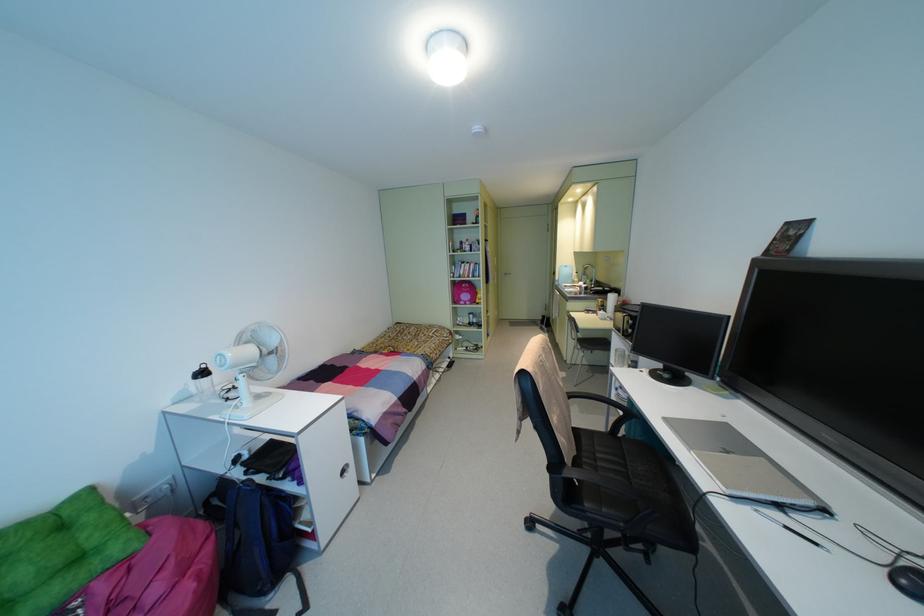
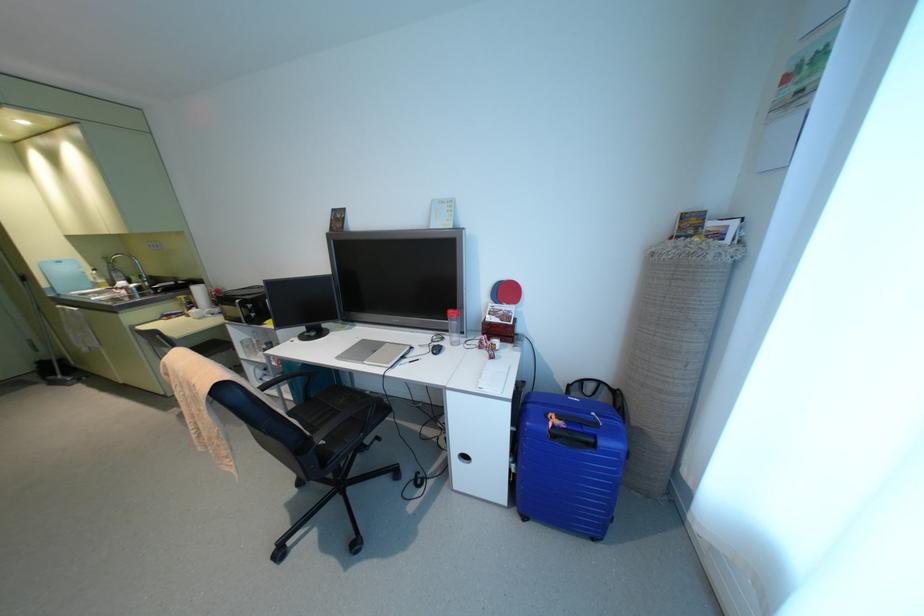
The point at (585, 288) is marked in the first image. Where is the corresponding point in the second image?

(139, 288)